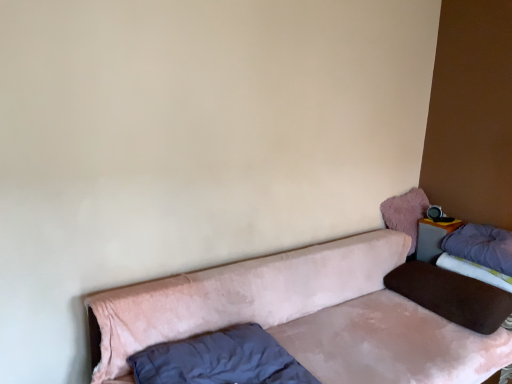
Question: Is velvet pink couch at lower center closer to the viewer compared to velvet pink pillow at upper right, positioned as the 3th pillow in right-to-left order?

Choices:
 (A) yes
 (B) no

Answer: (A)

Question: Is velvet pink pillow at upper right, the 2th pillow positioned from the left, inside velvet pink couch at lower center?

Choices:
 (A) yes
 (B) no

Answer: (B)

Question: Can you confirm if velvet pink couch at lower center is thinner than velvet pink pillow at upper right, the 2th pillow positioned from the left?

Choices:
 (A) yes
 (B) no

Answer: (B)

Question: Can you confirm if velvet pink couch at lower center is positioned to the right of velvet pink pillow at upper right, the 2th pillow positioned from the left?

Choices:
 (A) no
 (B) yes

Answer: (A)

Question: Are velvet pink couch at lower center and velvet pink pillow at upper right, the 2th pillow positioned from the left, located far from each other?

Choices:
 (A) no
 (B) yes

Answer: (A)

Question: Based on their positions, is velvet purple mattress at right located to the left or right of matte gray table at upper right?

Choices:
 (A) right
 (B) left

Answer: (A)

Question: Considering the positions of velvet purple mattress at right and matte gray table at upper right in the image, is velvet purple mattress at right taller or shorter than matte gray table at upper right?

Choices:
 (A) tall
 (B) short

Answer: (B)

Question: Considering the positions of point (479, 271) and point (434, 253), is point (479, 271) closer or farther from the camera than point (434, 253)?

Choices:
 (A) farther
 (B) closer

Answer: (B)

Question: In terms of size, does velvet purple mattress at right appear bigger or smaller than matte gray table at upper right?

Choices:
 (A) big
 (B) small

Answer: (A)

Question: From a real-world perspective, relative to velvet pink pillow at upper right, the 2th pillow positioned from the left, is brown velvety pillow at right, placed as the 2th pillow when sorted from right to left, vertically above or below?

Choices:
 (A) above
 (B) below

Answer: (B)

Question: Does point (465, 278) appear closer or farther from the camera than point (413, 223)?

Choices:
 (A) closer
 (B) farther

Answer: (A)

Question: Would you say brown velvety pillow at right, placed as the 2th pillow when sorted from right to left, is to the left or to the right of velvet pink pillow at upper right, positioned as the 3th pillow in right-to-left order, in the picture?

Choices:
 (A) left
 (B) right

Answer: (B)

Question: Do you think brown velvety pillow at right, placed as the 2th pillow when sorted from right to left, is within velvet pink pillow at upper right, positioned as the 3th pillow in right-to-left order, or outside of it?

Choices:
 (A) inside
 (B) outside

Answer: (B)

Question: From the image's perspective, is purple soft pillow at upper right, the first pillow from the right, positioned above or below velvet purple mattress at right?

Choices:
 (A) above
 (B) below

Answer: (A)

Question: Is purple soft pillow at upper right, the fourth pillow positioned from the left, bigger or smaller than velvet purple mattress at right?

Choices:
 (A) small
 (B) big

Answer: (B)